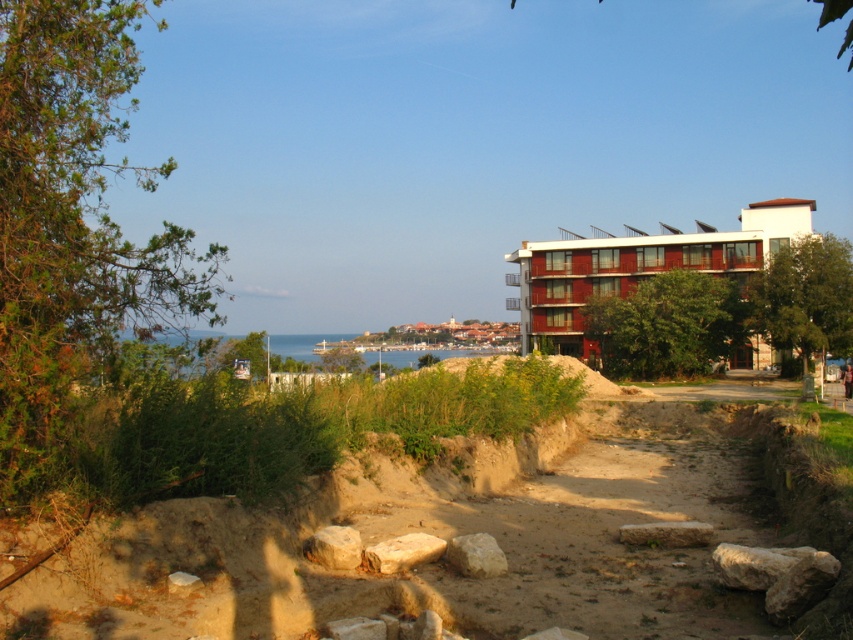
Question: Is red wooden building at right below smooth beige stone at center?

Choices:
 (A) no
 (B) yes

Answer: (A)

Question: Which object appears farthest from the camera in this image?

Choices:
 (A) smooth beige rock at center
 (B) blue water at center
 (C) smooth gray rock at center

Answer: (B)

Question: Which object appears closest to the camera in this image?

Choices:
 (A) smooth beige stone at center
 (B) smooth gray rock at center
 (C) smooth beige rock at center

Answer: (C)

Question: Can you confirm if smooth beige stone at center is positioned above smooth gray rock at center?

Choices:
 (A) yes
 (B) no

Answer: (B)

Question: Which is nearer to the smooth gray rock at center?

Choices:
 (A) smooth beige rock at center
 (B) red wooden building at right
 (C) smooth beige stone at center
 (D) blue water at center

Answer: (A)

Question: Is the position of gray rough rock at center more distant than that of smooth beige stone at center?

Choices:
 (A) no
 (B) yes

Answer: (A)